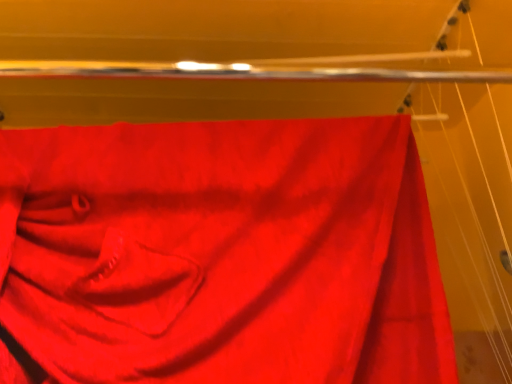
Locate an element on the screen. This screenshot has height=384, width=512. matte red fabric at center is located at coordinates tap(223, 253).

What do you see at coordinates (223, 253) in the screenshot?
I see `matte red fabric at center` at bounding box center [223, 253].

Measure the distance between point (269, 228) and camera.

A distance of 30.67 inches exists between point (269, 228) and camera.

What is the approximate width of matte red fabric at center?

The width of matte red fabric at center is 6.09 inches.

The height and width of the screenshot is (384, 512). I want to click on matte red fabric at center, so click(223, 253).